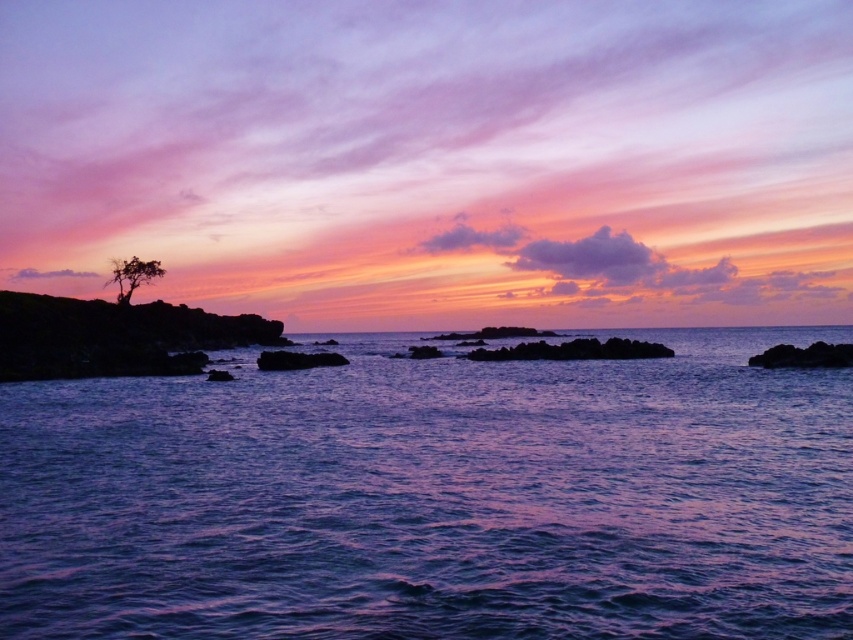
You are an artist trying to paint the coastal scene. You want to ensure the purple translucent water at center and the silhouette tree at left are proportionally accurate. Which object should you paint wider in your artwork?

The purple translucent water at center should be painted wider than the silhouette tree at left because its width is larger than the silhouette tree at left.

You are an artist trying to paint the coastal scene. You want to ensure the purple translucent water at center and the silhouette tree at left are proportionally accurate. Which object should you paint larger?

The purple translucent water at center should be painted larger than the silhouette tree at left because it is bigger than the silhouette tree at left according to the description.

You are a marine biologist studying water properties. You observe the purple translucent water at center in the image. What is the exact coordinate of this water area?

The purple translucent water at center is located at coordinate point (436, 497).